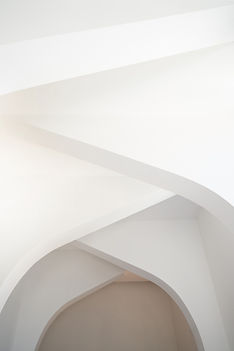
Locate an element on the screen. The height and width of the screenshot is (351, 234). second highest shelf is located at coordinates (166, 115).